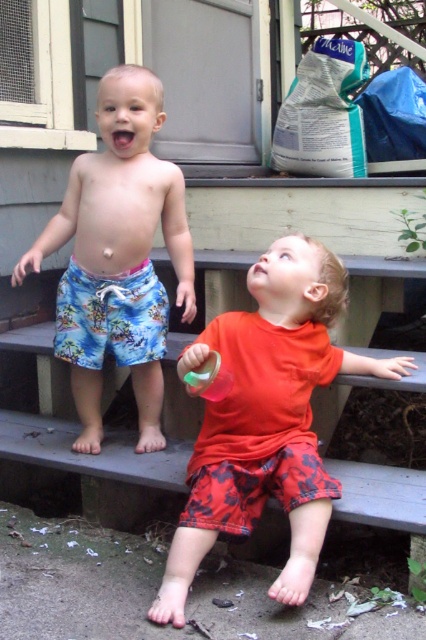
Is matte orange t-shirt at center to the right of blue floral shorts at left from the viewer's perspective?

Correct, you'll find matte orange t-shirt at center to the right of blue floral shorts at left.

Which is more to the right, matte orange t-shirt at center or blue floral shorts at left?

matte orange t-shirt at center is more to the right.

This screenshot has height=640, width=426. What do you see at coordinates (267, 419) in the screenshot?
I see `matte orange t-shirt at center` at bounding box center [267, 419].

Identify the location of matte orange t-shirt at center. The width and height of the screenshot is (426, 640). (267, 419).